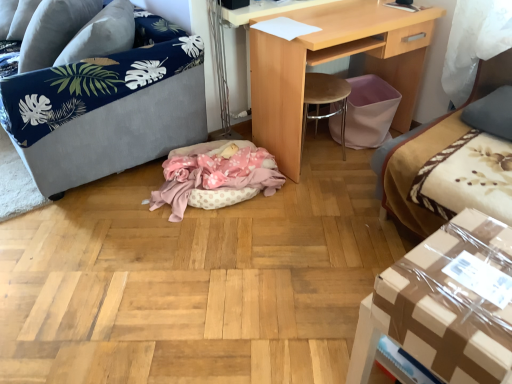
Question: Is pink polka dot fabric cat bed at center completely or partially outside of gray fabric pillow at upper left, the second pillow from the bottom?

Choices:
 (A) yes
 (B) no

Answer: (A)

Question: Does pink polka dot fabric cat bed at center touch gray fabric pillow at upper left, the second pillow in the front-to-back sequence?

Choices:
 (A) yes
 (B) no

Answer: (B)

Question: Is pink polka dot fabric cat bed at center oriented away from gray fabric pillow at upper left, the second pillow in the front-to-back sequence?

Choices:
 (A) no
 (B) yes

Answer: (A)

Question: Is pink polka dot fabric cat bed at center not close to gray fabric pillow at upper left, the second pillow in the front-to-back sequence?

Choices:
 (A) yes
 (B) no

Answer: (B)

Question: Is pink polka dot fabric cat bed at center shorter than gray fabric pillow at upper left, the second pillow in the front-to-back sequence?

Choices:
 (A) no
 (B) yes

Answer: (B)

Question: From a real-world perspective, is pink polka dot fabric cat bed at center on gray fabric pillow at upper left, the first pillow positioned from the back?

Choices:
 (A) yes
 (B) no

Answer: (B)

Question: From the image's perspective, does gray fabric pillow at upper left, the 1th pillow in the top-to-bottom sequence, appear lower than pink polka dot fabric cat bed at center?

Choices:
 (A) yes
 (B) no

Answer: (B)

Question: Does gray fabric pillow at upper left, the second pillow when ordered from right to left, lie in front of pink polka dot fabric cat bed at center?

Choices:
 (A) yes
 (B) no

Answer: (B)

Question: Is gray fabric pillow at upper left, the second pillow when ordered from right to left, further to camera compared to pink polka dot fabric cat bed at center?

Choices:
 (A) no
 (B) yes

Answer: (B)

Question: Can you confirm if gray fabric pillow at upper left, the first pillow positioned from the back, is bigger than pink polka dot fabric cat bed at center?

Choices:
 (A) no
 (B) yes

Answer: (B)

Question: Does gray fabric pillow at upper left, the second pillow from the bottom, appear on the left side of pink polka dot fabric cat bed at center?

Choices:
 (A) no
 (B) yes

Answer: (B)

Question: Is gray fabric pillow at upper left, the second pillow from the bottom, next to pink polka dot fabric cat bed at center?

Choices:
 (A) no
 (B) yes

Answer: (A)

Question: Does velvet grey sofa at left turn towards light wood desk at center?

Choices:
 (A) yes
 (B) no

Answer: (B)